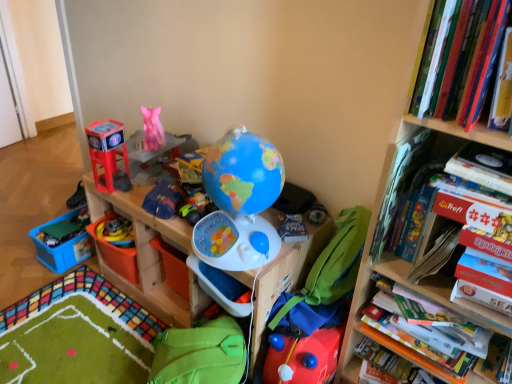
Question: From a real-world perspective, is rubber yellow toy at lower left, which ranks as the third toy in bottom-to-top order, above or below wooden toy storage at center?

Choices:
 (A) above
 (B) below

Answer: (A)

Question: Relative to wooden toy storage at center, is rubber yellow toy at lower left, which ranks as the third toy in bottom-to-top order, in front or behind?

Choices:
 (A) behind
 (B) front

Answer: (A)

Question: Which object is the farthest from the matte plastic globe at center, the second toy viewed from the right?

Choices:
 (A) matte plastic toy at left, which is counted as the third toy, starting from the left
 (B) hardcover book at upper right, arranged as the 1th book when viewed from the top
 (C) green plastic toy at lower left, which appears as the 5th toy when viewed from the top
 (D) white glossy board game at right, which is the third book from top to bottom
 (E) rubber yellow toy at lower left, the fifth toy viewed from the right

Answer: (C)

Question: Which object is the farthest from the blue plastic storage box at lower left?

Choices:
 (A) green fabric bean bag chair at center, placed as the first bean bag chair when sorted from right to left
 (B) matte plastic toy at left, which is the 4th toy from right to left
 (C) hardcover book at upper right, marked as the second book in a bottom-to-top arrangement
 (D) green plastic toy at lower left, which appears as the first toy when viewed from the left
 (E) hardcover book at upper right, the 3th book when ordered from bottom to top

Answer: (E)